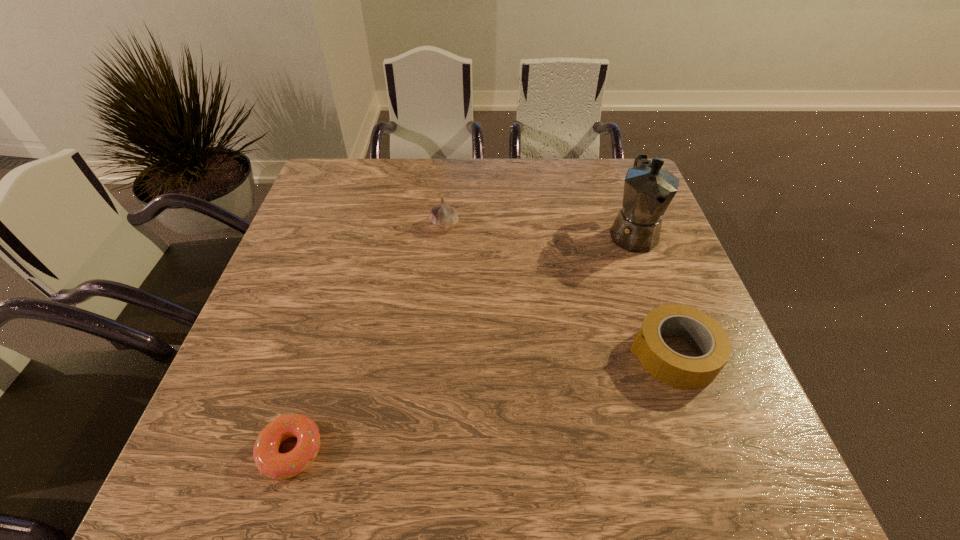
Identify the location of free space that is in between the duct tape and the coffeepot. This screenshot has width=960, height=540. (653, 294).

Identify the location of vacant area that lies between the garlic and the second shortest object. Image resolution: width=960 pixels, height=540 pixels. (559, 289).

Locate an element on the screen. This screenshot has height=540, width=960. vacant space that's between the tallest object and the second tallest object is located at coordinates (539, 229).

Find the location of a particular element. free space between the second shortest object and the shortest object is located at coordinates (483, 403).

Identify the location of object that stands as the second closest to the nearest object. This screenshot has width=960, height=540. (679, 371).

I want to click on object that ranks as the second closest to the doughnut, so click(x=679, y=371).

Find the location of a particular element. The image size is (960, 540). free spot that satisfies the following two spatial constraints: 1. on the pouring side of the tallest object; 2. at the edge of the duct tape is located at coordinates (677, 354).

This screenshot has width=960, height=540. I want to click on free spot that satisfies the following two spatial constraints: 1. on the back side of the nearest object; 2. on the left side of the second object from left to right, so click(x=359, y=225).

Find the location of a particular element. free region that satisfies the following two spatial constraints: 1. on the pouring side of the coffeepot; 2. at the edge of the duct tape is located at coordinates (677, 354).

This screenshot has width=960, height=540. Find the location of `vacant space that satisfies the following two spatial constraints: 1. on the pouring side of the tallest object; 2. at the edge of the duct tape`. vacant space that satisfies the following two spatial constraints: 1. on the pouring side of the tallest object; 2. at the edge of the duct tape is located at coordinates (677, 354).